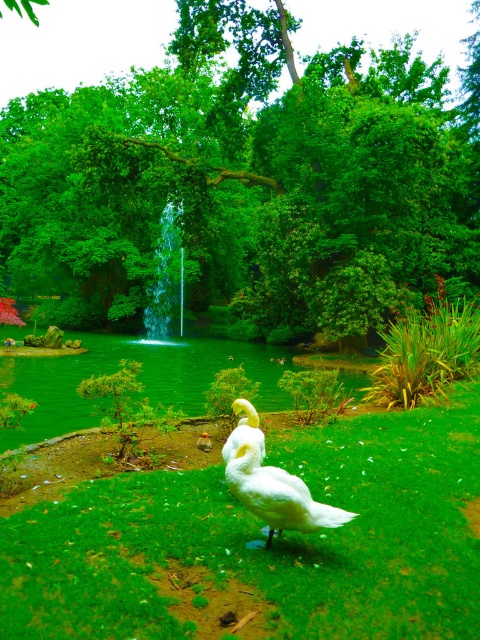
Question: Considering the real-world distances, which object is closest to the white matte duck at center?

Choices:
 (A) green grass at lower center
 (B) green glossy pond at center

Answer: (A)

Question: Among these points, which one is farthest from the camera?

Choices:
 (A) (467, 545)
 (B) (16, 333)
 (C) (317, 522)

Answer: (B)

Question: Can you confirm if green leafy tree at center is positioned to the right of white matte duck at center?

Choices:
 (A) no
 (B) yes

Answer: (A)

Question: Does green grass at lower center appear on the right side of white matte duck at center?

Choices:
 (A) no
 (B) yes

Answer: (B)

Question: Among these points, which one is nearest to the camera?

Choices:
 (A) (196, 157)
 (B) (455, 428)

Answer: (B)

Question: Does green grass at lower center appear over green glossy pond at center?

Choices:
 (A) no
 (B) yes

Answer: (A)